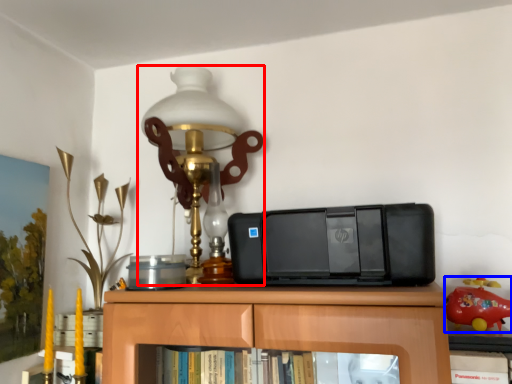
Question: Which object is closer to the camera taking this photo, lamp (highlighted by a red box) or toy (highlighted by a blue box)?

Choices:
 (A) lamp
 (B) toy

Answer: (B)